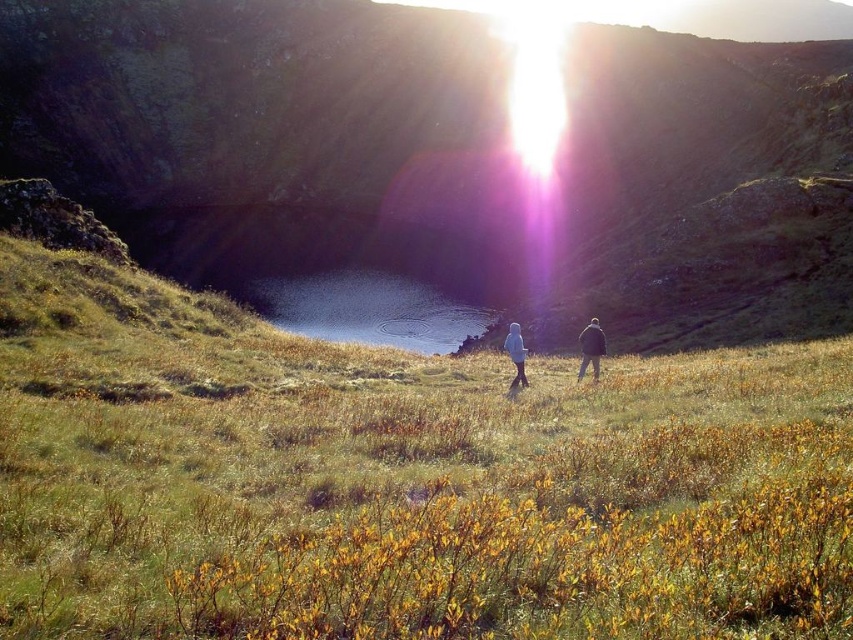
Which is more to the right, light blue fabric couple at center or light blue woolen coat at center?

From the viewer's perspective, light blue fabric couple at center appears more on the right side.

Where is `light blue fabric couple at center`? light blue fabric couple at center is located at coordinates (590, 348).

Who is positioned more to the left, green grassy at center or light blue fabric couple at center?

green grassy at center

Based on the photo, can you confirm if green grassy at center is wider than light blue fabric couple at center?

Yes, green grassy at center is wider than light blue fabric couple at center.

Does point (750, 516) come in front of point (596, 356)?

Yes, point (750, 516) is in front of point (596, 356).

The image size is (853, 640). What are the coordinates of `green grassy at center` in the screenshot? It's located at (399, 480).

Who is positioned more to the left, green grassy hillside at center or smooth reflective water at center?

Positioned to the left is green grassy hillside at center.

Measure the distance between green grassy hillside at center and smooth reflective water at center.

green grassy hillside at center and smooth reflective water at center are 19.26 meters apart.

The image size is (853, 640). Describe the element at coordinates (445, 164) in the screenshot. I see `green grassy hillside at center` at that location.

Where is `green grassy hillside at center`? green grassy hillside at center is located at coordinates (445, 164).